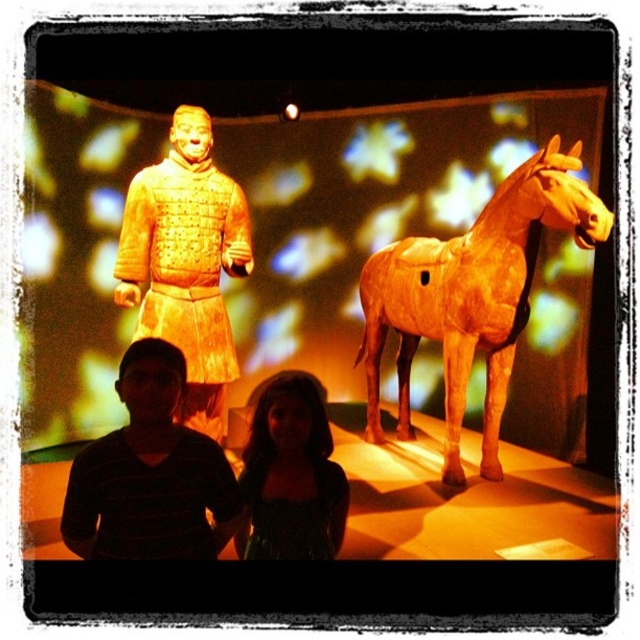
Is matte gold horse at right to the left of black striped shirt at lower left from the viewer's perspective?

In fact, matte gold horse at right is to the right of black striped shirt at lower left.

Is point (488, 337) in front of point (120, 458)?

No, it is not.

Where is `matte gold horse at right`? This screenshot has width=640, height=640. matte gold horse at right is located at coordinates (472, 296).

Does point (195, 268) lie in front of point (284, 483)?

That is False.

Locate an element on the screen. matte gold armor at upper left is located at coordinates (186, 262).

Where is `matte gold horse at right`? The image size is (640, 640). matte gold horse at right is located at coordinates (472, 296).

Is matte gold horse at right shorter than dark green fabric dress at lower center?

No.

Between point (545, 205) and point (289, 436), which one is positioned behind?

Positioned behind is point (545, 205).

This screenshot has height=640, width=640. I want to click on matte gold horse at right, so click(x=472, y=296).